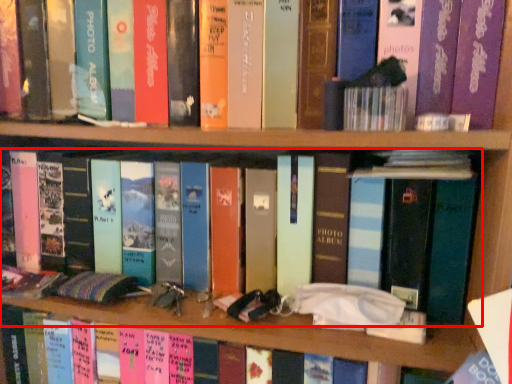
Question: Observing the image, what is the correct spatial positioning of book (annotated by the red box) in reference to book?

Choices:
 (A) left
 (B) right

Answer: (A)